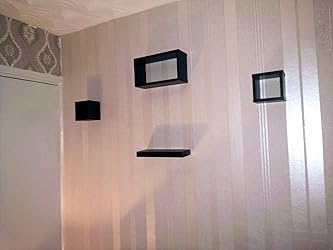
The width and height of the screenshot is (333, 250). I want to click on ceiling, so click(80, 11).